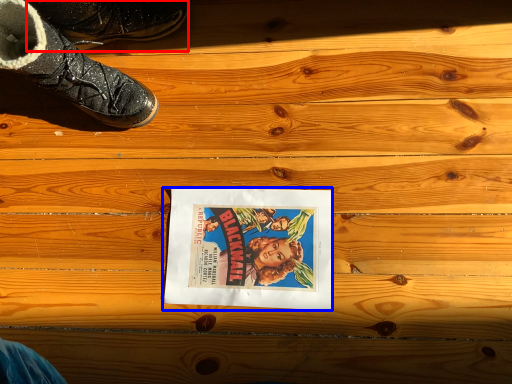
Question: Which object appears farthest to the camera in this image, footwear (highlighted by a red box) or movie poster (highlighted by a blue box)?

Choices:
 (A) footwear
 (B) movie poster

Answer: (B)